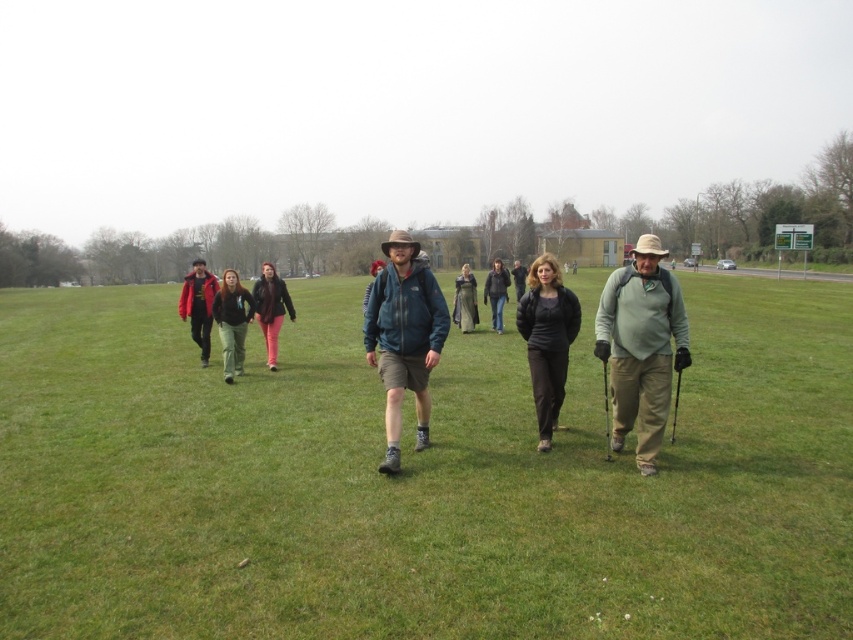
Question: Based on their relative distances, which object is nearer to the dark gray jacket at center?

Choices:
 (A) matte red jacket at left
 (B) dark green pants at center
 (C) dark gray wool sweater at center
 (D) black leather jacket at center

Answer: (C)

Question: Is matte pink pants at center positioned before black leather jacket at center?

Choices:
 (A) no
 (B) yes

Answer: (B)

Question: Can you confirm if matte pink pants at center is positioned below black leather jacket at center?

Choices:
 (A) no
 (B) yes

Answer: (B)

Question: Which point is closer to the camera taking this photo?

Choices:
 (A) (494, 259)
 (B) (457, 276)
 (C) (390, 356)

Answer: (C)

Question: Can you confirm if green grass at center is thinner than blue fabric jacket at center?

Choices:
 (A) yes
 (B) no

Answer: (B)

Question: Which object is the closest to the green fabric jacket at center?

Choices:
 (A) dark green pants at center
 (B) dark gray jacket at center
 (C) black matte jacket at center
 (D) green grass at center

Answer: (C)